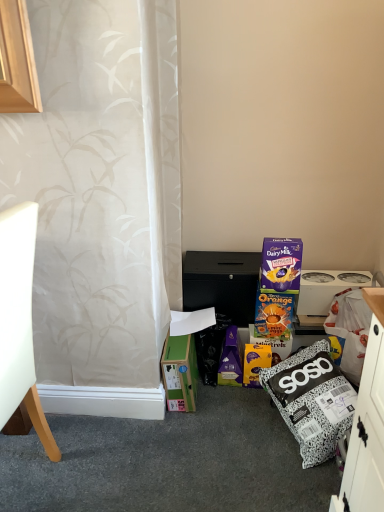
Question: Does white plastic appliance at right have a greater height compared to white matte chair at left?

Choices:
 (A) no
 (B) yes

Answer: (A)

Question: From the image's perspective, is white plastic appliance at right located beneath white matte chair at left?

Choices:
 (A) yes
 (B) no

Answer: (B)

Question: Is white plastic appliance at right positioned beyond the bounds of white matte chair at left?

Choices:
 (A) yes
 (B) no

Answer: (A)

Question: Considering the relative sizes of white plastic appliance at right and white matte chair at left in the image provided, is white plastic appliance at right smaller than white matte chair at left?

Choices:
 (A) yes
 (B) no

Answer: (A)

Question: Could you tell me if white plastic appliance at right is turned towards white matte chair at left?

Choices:
 (A) yes
 (B) no

Answer: (B)

Question: Is white matte chair at left completely or partially inside white plastic appliance at right?

Choices:
 (A) no
 (B) yes

Answer: (A)

Question: Considering the relative positions of white plastic appliance at right and green cardboard box at lower left in the image provided, is white plastic appliance at right to the right of green cardboard box at lower left from the viewer's perspective?

Choices:
 (A) yes
 (B) no

Answer: (A)

Question: From a real-world perspective, is white plastic appliance at right on top of green cardboard box at lower left?

Choices:
 (A) yes
 (B) no

Answer: (A)

Question: From a real-world perspective, is white plastic appliance at right under green cardboard box at lower left?

Choices:
 (A) yes
 (B) no

Answer: (B)

Question: Is green cardboard box at lower left located within white plastic appliance at right?

Choices:
 (A) no
 (B) yes

Answer: (A)

Question: Is white plastic appliance at right closer to the viewer compared to green cardboard box at lower left?

Choices:
 (A) yes
 (B) no

Answer: (B)

Question: Can you confirm if white plastic appliance at right is bigger than green cardboard box at lower left?

Choices:
 (A) yes
 (B) no

Answer: (B)

Question: Does black matte cabinet at center have a lesser height compared to green cardboard box at lower left?

Choices:
 (A) yes
 (B) no

Answer: (A)